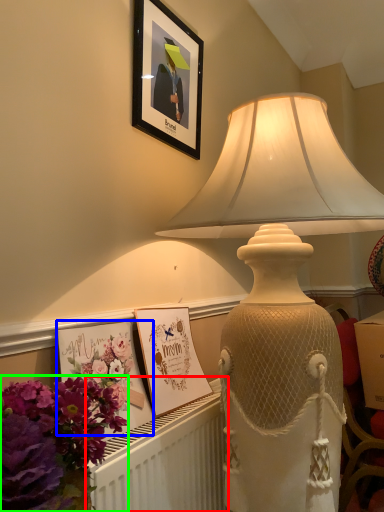
Question: Considering the real-world distances, which object is farthest from radiator (highlighted by a red box)? postcard (highlighted by a blue box) or flower (highlighted by a green box)?

Choices:
 (A) postcard
 (B) flower

Answer: (B)